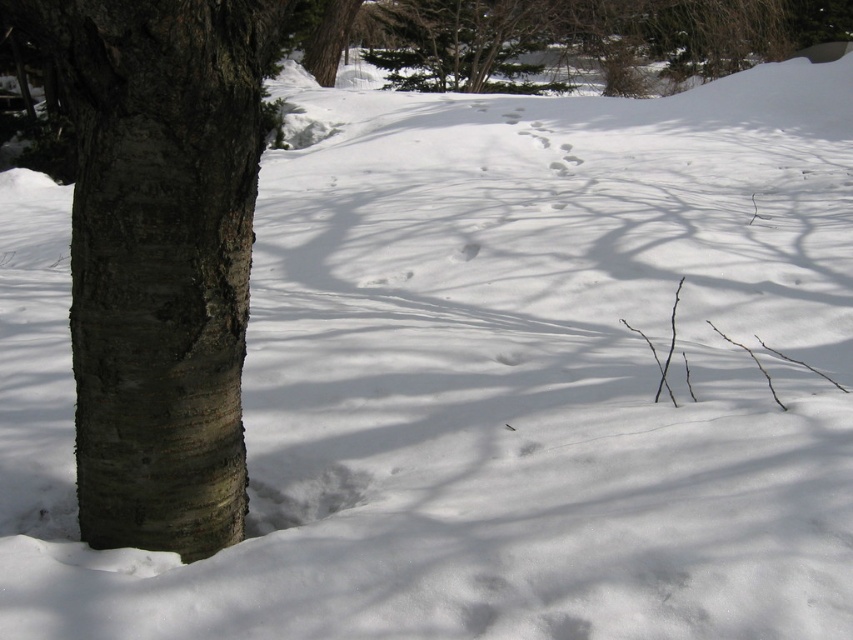
You are standing at the center of the snowy landscape and want to walk towards the smooth bark tree trunk at left. In which direction should you head?

Since the smooth bark tree trunk at left is located at point 0.402 on the x axis and 0.189 on the y axis, you should head towards the left and slightly forward to reach it.

You are standing in the winter scene and want to take a photo of the smooth bark tree trunk at left. If you are currently 4 feet away from it, should you move closer or farther away to get a better shot?

The smooth bark tree trunk at left is 4.10 feet away from the camera. Since you are currently 4 feet away, you are already closer than the optimal distance. To get a better shot, you should move slightly farther away to match the 4.10 feet distance for proper framing.